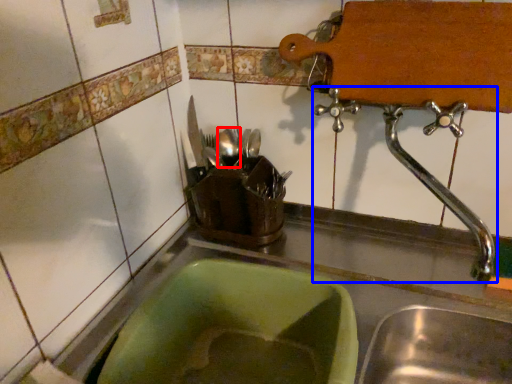
Question: Which object is closer to the camera taking this photo, tableware (highlighted by a red box) or tap (highlighted by a blue box)?

Choices:
 (A) tableware
 (B) tap

Answer: (B)